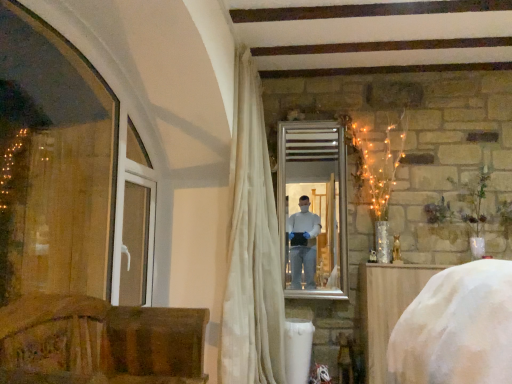
Question: From a real-world perspective, relative to silver/metallic mirror at center, is wooden chair at lower left, positioned as the second furniture in right-to-left order, vertically above or below?

Choices:
 (A) below
 (B) above

Answer: (A)

Question: Is point (114, 322) positioned closer to the camera than point (288, 221)?

Choices:
 (A) farther
 (B) closer

Answer: (B)

Question: Based on their relative distances, which object is nearer to the silver/metallic mirror at center?

Choices:
 (A) white sheer curtain at center
 (B) white fabric-covered object at lower right, which is counted as the 1th furniture, starting from the right
 (C) white plastic window frame at left
 (D) wooden chair at lower left, the second furniture viewed from the back

Answer: (A)

Question: Estimate the real-world distances between objects in this image. Which object is farther from the white sheer curtain at center?

Choices:
 (A) silver/metallic mirror at center
 (B) white plastic window frame at left
 (C) wooden chair at lower left, which is the 1th furniture in front-to-back order
 (D) white fabric-covered object at lower right, the first furniture from the back

Answer: (C)